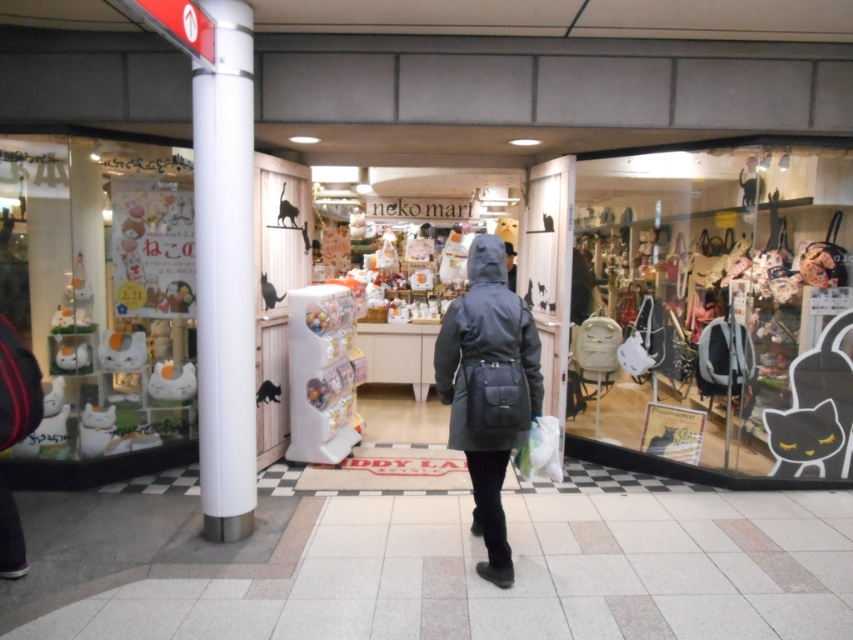
You are a customer entering the shop and want to hang your coat on the white smooth pole at left. However, you notice the dark gray hooded coat at center is already hanging there. Can the pole accommodate both coats without the coats overlapping?

The white smooth pole at left has a width less than the dark gray hooded coat at center, so it might not have enough space to accommodate both coats without overlapping. Consider finding another hanger or pole.

You are a delivery person standing at the entrance of the shop. You need to place a package on the white smooth pole at left. Can you reach it without moving closer?

The white smooth pole at left is 3.28 meters from the camera. Since the delivery person is standing at the entrance, they are likely at the same distance as the camera. The average human arm reach is about 1.8 meters, so 3.28 meters is too far to reach without moving closer.